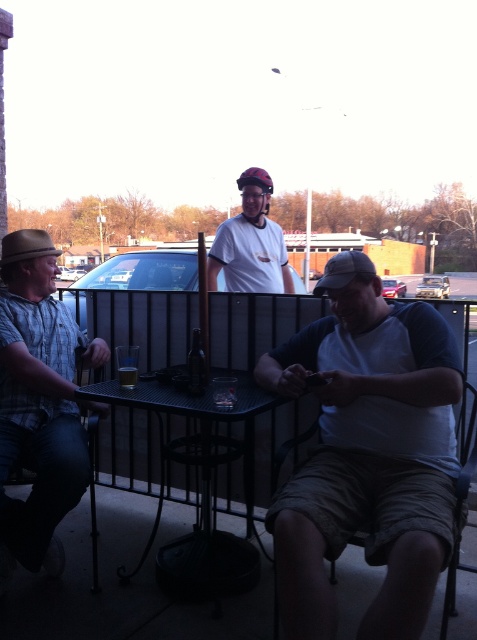
Question: Which of the following is the closest to the observer?

Choices:
 (A) (237, 582)
 (B) (53, 305)
 (C) (462, 428)
 (D) (232, 227)

Answer: (C)

Question: Which object is the closest to the tan fabric chair at lower right?

Choices:
 (A) matte white helmet at center
 (B) metallic black table at center

Answer: (B)

Question: In this image, where is white cotton shirt at center located relative to metallic black table at center?

Choices:
 (A) right
 (B) left

Answer: (A)

Question: Is metallic black table at center to the right of matte white helmet at center from the viewer's perspective?

Choices:
 (A) yes
 (B) no

Answer: (B)

Question: Is plaid shirt at left above metallic black table at center?

Choices:
 (A) yes
 (B) no

Answer: (A)

Question: Which is farther from the metallic black table at center?

Choices:
 (A) matte white helmet at center
 (B) plaid shirt at left
 (C) tan fabric chair at lower right
 (D) white cotton shirt at center

Answer: (A)